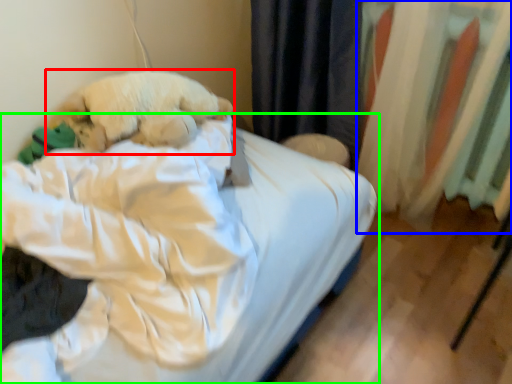
Question: Which object is the farthest from dog (highlighted by a red box)? Choose among these: curtain (highlighted by a blue box) or bed (highlighted by a green box).

Choices:
 (A) curtain
 (B) bed

Answer: (A)